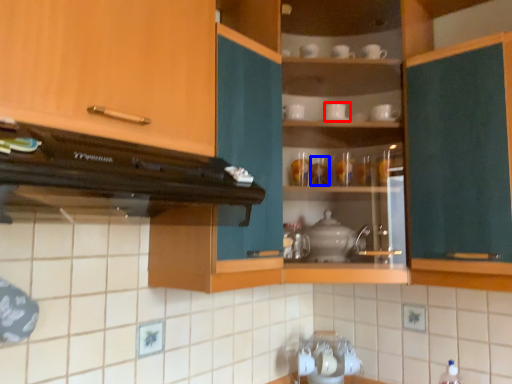
Question: Which object appears farthest to the camera in this image, tableware (highlighted by a red box) or tableware (highlighted by a blue box)?

Choices:
 (A) tableware
 (B) tableware

Answer: (B)